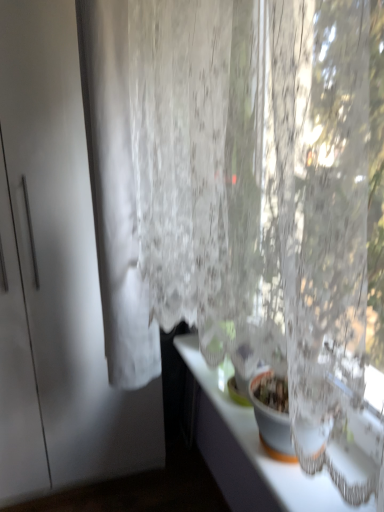
Question: From a real-world perspective, is white sheer curtain at left positioned above or below white matte screen door at left?

Choices:
 (A) below
 (B) above

Answer: (B)

Question: Is white sheer curtain at left inside the boundaries of white matte screen door at left, or outside?

Choices:
 (A) inside
 (B) outside

Answer: (B)

Question: Which object is the farthest from the white glossy counter top at lower right?

Choices:
 (A) white matte screen door at left
 (B) white sheer curtain at left

Answer: (B)

Question: Estimate the real-world distances between objects in this image. Which object is closer to the white matte screen door at left?

Choices:
 (A) white glossy counter top at lower right
 (B) white sheer curtain at left

Answer: (B)